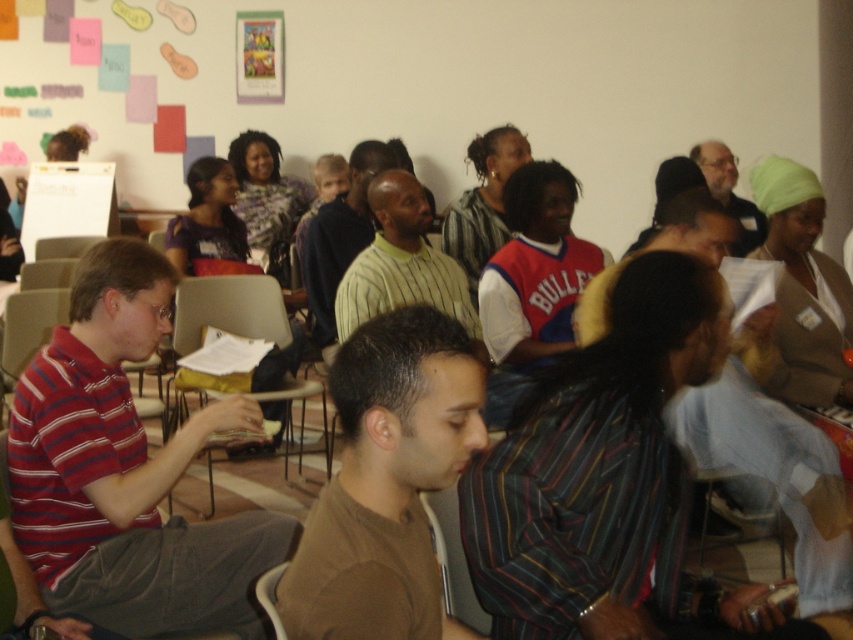
Can you confirm if yellow striped shirt at center is wider than beige plastic chair at center?

No.

Which is behind, point (419, 202) or point (253, 312)?

Positioned behind is point (253, 312).

The width and height of the screenshot is (853, 640). What do you see at coordinates (402, 262) in the screenshot?
I see `yellow striped shirt at center` at bounding box center [402, 262].

At what (x,y) coordinates should I click in order to perform the action: click on yellow striped shirt at center. Please return your answer as a coordinate pair (x, y). The image size is (853, 640). Looking at the image, I should click on (402, 262).

Which is more to the left, red jersey at center or matte black shirt at upper right?

red jersey at center

Which is in front, point (556, 212) or point (717, 193)?

Point (556, 212) is more forward.

Is point (518, 246) positioned behind point (751, 241)?

No, (518, 246) is closer to viewer.

The image size is (853, 640). In order to click on red jersey at center in this screenshot , I will do `click(535, 268)`.

Can you confirm if yellow striped shirt at center is shorter than matte black shirt at upper right?

Indeed, yellow striped shirt at center has a lesser height compared to matte black shirt at upper right.

Where is `yellow striped shirt at center`? This screenshot has width=853, height=640. yellow striped shirt at center is located at coordinates (402, 262).